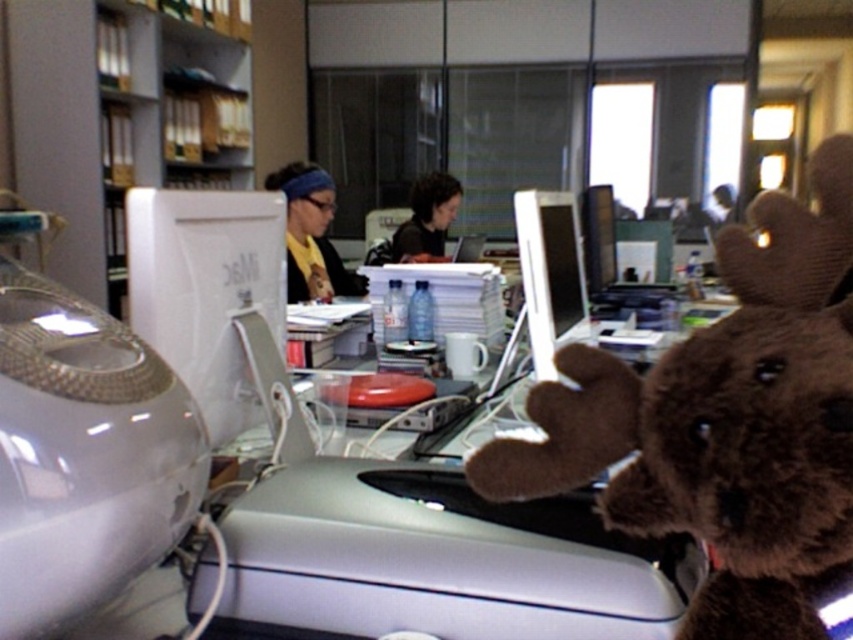
Question: Is brown plush toy at center thinner than matte black monitor at center?

Choices:
 (A) no
 (B) yes

Answer: (A)

Question: Is the position of white plastic bookshelf at left less distant than that of matte black monitor at center?

Choices:
 (A) yes
 (B) no

Answer: (B)

Question: Which object is the closest to the white glossy monitor at center?

Choices:
 (A) brown plush toy at center
 (B) matte black monitor at center

Answer: (A)

Question: Is white plastic bookshelf at left to the right of matte black monitor at center from the viewer's perspective?

Choices:
 (A) no
 (B) yes

Answer: (A)

Question: Which point appears closest to the camera in this image?

Choices:
 (A) (242, 52)
 (B) (750, 461)
 (C) (241, 244)

Answer: (B)

Question: Which object is the farthest from the white plastic bookshelf at left?

Choices:
 (A) dark brown plush toy at center
 (B) white glossy monitor at center
 (C) matte black monitor at center
 (D) matte black hairband at upper center

Answer: (B)